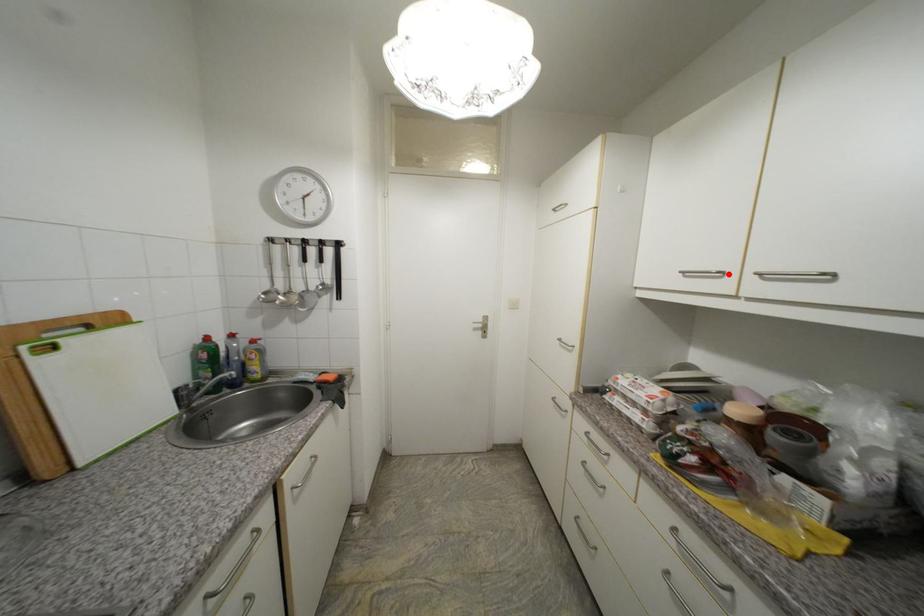
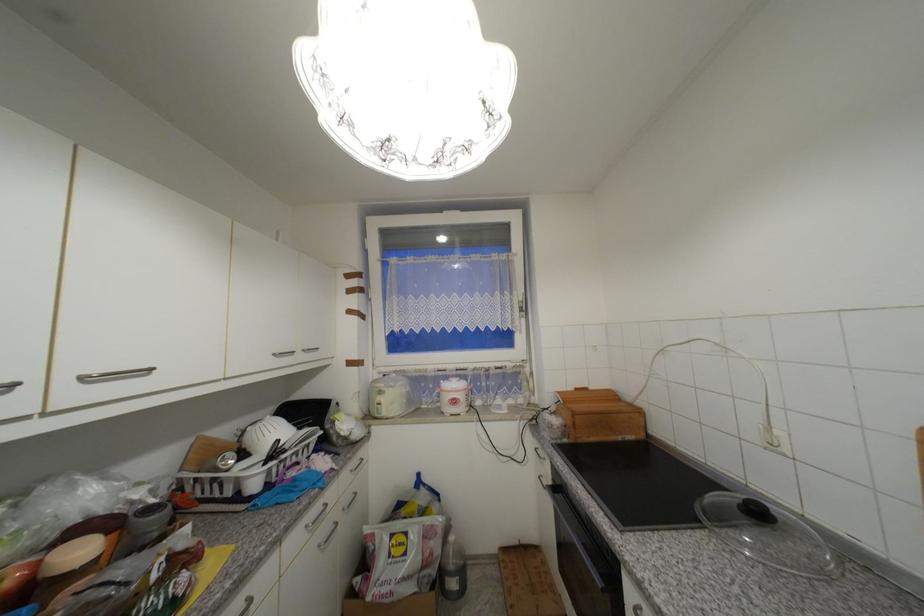
Locate, in the second image, the point that corresponds to the highlighted location in the first image.

(19, 386)